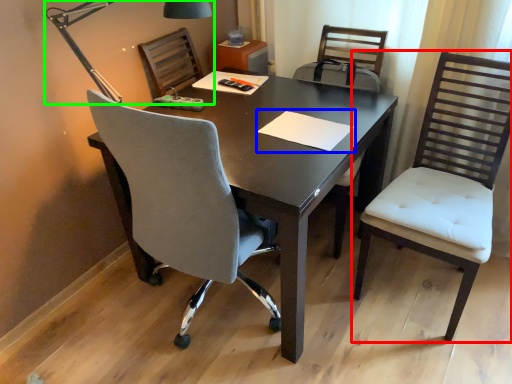
Question: Which is farther away from chair (highlighted by a red box)? notepad (highlighted by a blue box) or lamp (highlighted by a green box)?

Choices:
 (A) notepad
 (B) lamp

Answer: (B)